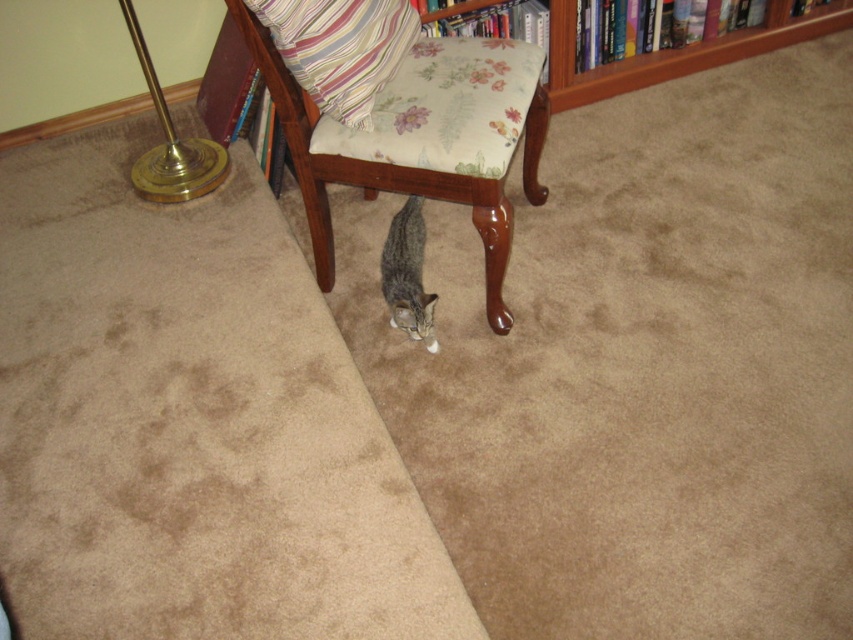
Question: Based on their relative distances, which object is nearer to the floral fabric chair at center?

Choices:
 (A) brass/metallic floor lamp at left
 (B) striped fabric pillow at upper center
 (C) tabby fur cat at center

Answer: (B)

Question: Which object appears farthest from the camera in this image?

Choices:
 (A) tabby fur cat at center
 (B) brass/metallic floor lamp at left
 (C) floral fabric chair at center

Answer: (B)

Question: Does striped fabric pillow at upper center appear under brass/metallic floor lamp at left?

Choices:
 (A) yes
 (B) no

Answer: (A)

Question: Can you confirm if striped fabric pillow at upper center is positioned below brass/metallic floor lamp at left?

Choices:
 (A) no
 (B) yes

Answer: (B)

Question: Does striped fabric pillow at upper center appear under tabby fur cat at center?

Choices:
 (A) yes
 (B) no

Answer: (B)

Question: Which object is closer to the camera taking this photo?

Choices:
 (A) tabby fur cat at center
 (B) brass/metallic floor lamp at left
 (C) floral fabric chair at center

Answer: (C)